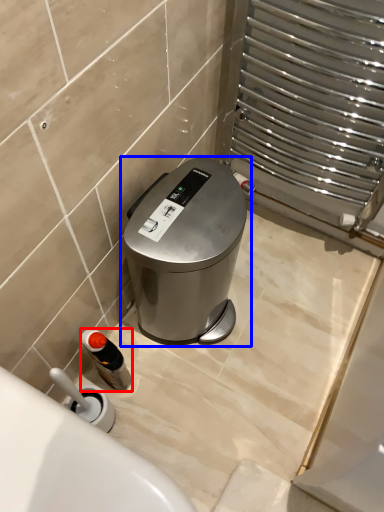
Question: Among these objects, which one is farthest to the camera, bottle (highlighted by a red box) or waste container (highlighted by a blue box)?

Choices:
 (A) bottle
 (B) waste container

Answer: (A)